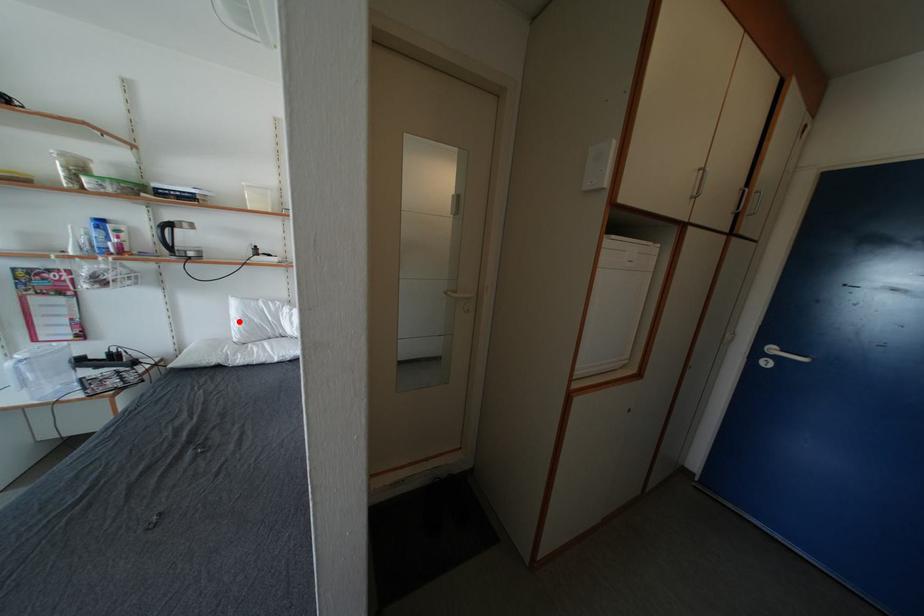
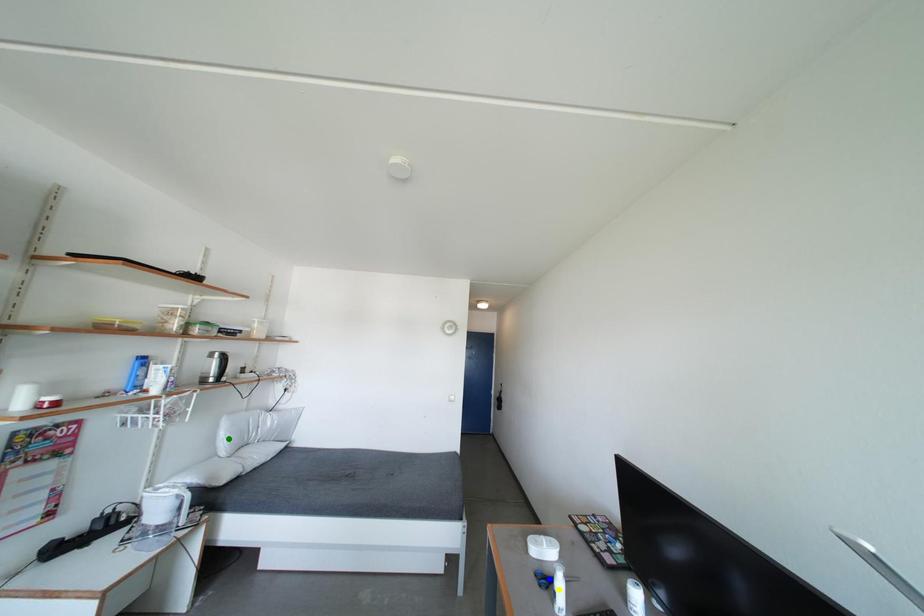
Question: I am providing you with two images of the same scene from different viewpoints. A red point is marked on the first image. You are given multiple points on the second image. Which spot in image 2 lines up with the point in image 1?

Choices:
 (A) blue point
 (B) yellow point
 (C) green point

Answer: (C)